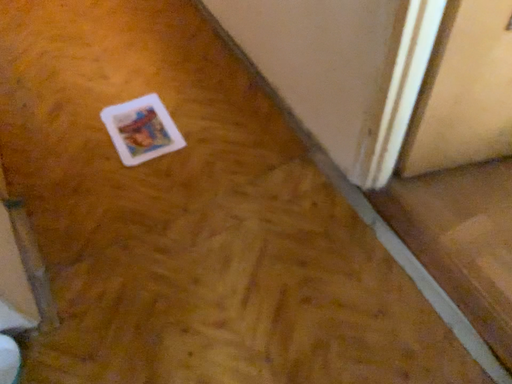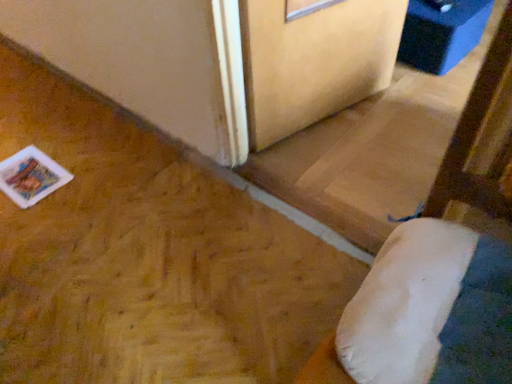
Question: How did the camera likely rotate when shooting the video?

Choices:
 (A) rotated downward
 (B) rotated upward

Answer: (B)